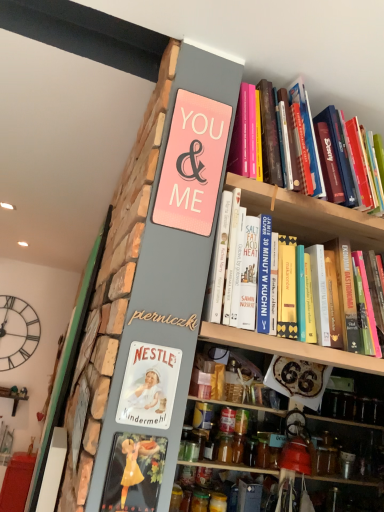
Question: Which is correct: hardcover books at upper right, which is counted as the second book, starting from the bottom, is inside wooden shelf at center, or outside of it?

Choices:
 (A) outside
 (B) inside

Answer: (A)

Question: Is point (365, 184) closer or farther from the camera than point (332, 430)?

Choices:
 (A) farther
 (B) closer

Answer: (B)

Question: Estimate the real-world distances between objects in this image. Which object is closer to the gold wood sign at center?

Choices:
 (A) pink matte sign at upper center
 (B) wooden shelf at center
 (C) hardcover book at upper right, positioned as the 1th book in bottom-to-top order
 (D) black metal clock at upper left
 (E) translucent glass jar at lower center, which appears as the 2th glass jar when viewed from the left

Answer: (A)

Question: Based on their relative distances, which object is nearer to the black metal clock at upper left?

Choices:
 (A) pink matte sign at upper center
 (B) gold wood sign at center
 (C) wooden shelf at center
 (D) hardcover book at upper right, acting as the second book starting from the top
 (E) metallic silver sign at lower center

Answer: (C)